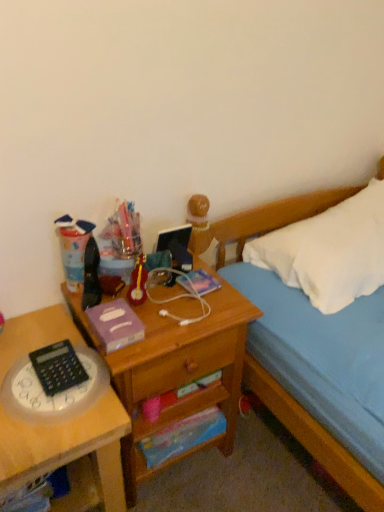
Question: From the image's perspective, is purple matte paper at center, which is the 3th paperback book from back to front, positioned above or below translucent plastic clock at lower left?

Choices:
 (A) above
 (B) below

Answer: (A)

Question: From their relative heights in the image, would you say purple matte paper at center, the 1th paperback book positioned from the front, is taller or shorter than translucent plastic clock at lower left?

Choices:
 (A) short
 (B) tall

Answer: (B)

Question: Estimate the real-world distances between objects in this image. Which object is farther from the translucent plastic clock at left, which appears as the 2th desk when viewed from the right?

Choices:
 (A) wooden drawer at center
 (B) matte plastic cup at left
 (C) wooden desk at center, the 2th desk in the left-to-right sequence
 (D) white soft bed at upper right
 (E) white soft pillow at upper right

Answer: (E)

Question: Considering the real-world distances, which object is closest to the translucent plastic clock at lower left?

Choices:
 (A) matte plastic cup at left
 (B) purple matte paper at center, the 1th paperback book positioned from the front
 (C) wooden drawer at center
 (D) wooden desk at center, the 2th desk in the left-to-right sequence
 (E) white soft bed at upper right

Answer: (B)